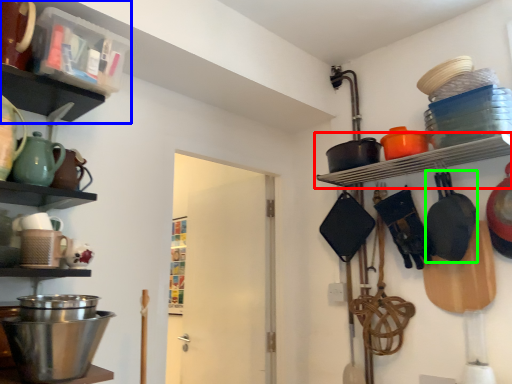
Question: Which is farther away from shelf (highlighted by a red box)? shelf (highlighted by a blue box) or frying pan (highlighted by a green box)?

Choices:
 (A) shelf
 (B) frying pan

Answer: (A)